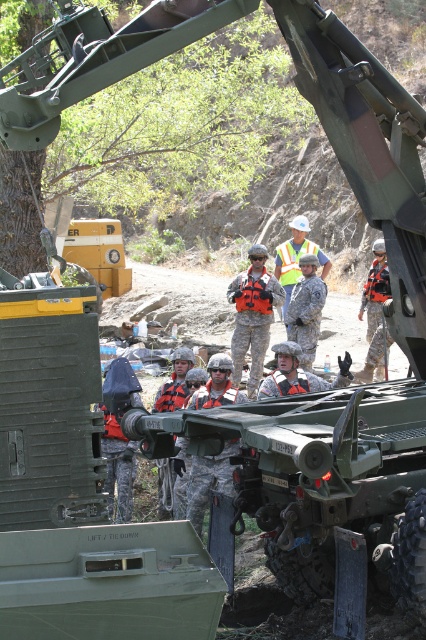
Question: Does orange life vest at center appear on the right side of camouflage uniform at center?

Choices:
 (A) no
 (B) yes

Answer: (A)

Question: Among these points, which one is farthest from the camera?

Choices:
 (A) (284, 294)
 (B) (279, 248)

Answer: (B)

Question: Does orange life vest at center appear on the left side of camouflage uniform at center?

Choices:
 (A) yes
 (B) no

Answer: (A)

Question: Observing the image, what is the correct spatial positioning of orange life vest at center in reference to camouflage uniform at center?

Choices:
 (A) left
 (B) right

Answer: (A)

Question: Among these points, which one is farthest from the camera?

Choices:
 (A) (302, 228)
 (B) (245, 275)

Answer: (A)